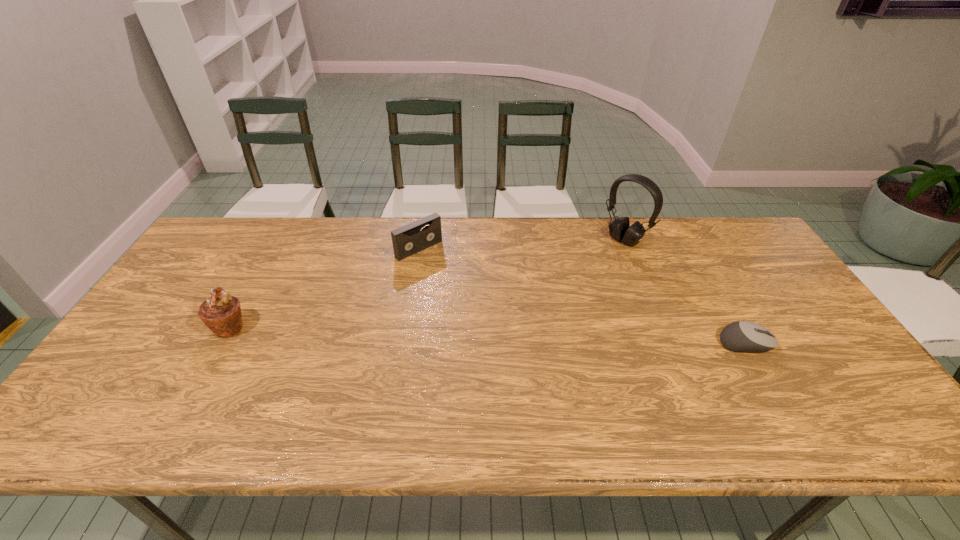
Find the location of `muffin`. muffin is located at coordinates (221, 313).

The height and width of the screenshot is (540, 960). I want to click on the second tallest object, so click(221, 313).

The width and height of the screenshot is (960, 540). I want to click on the rightmost object, so click(743, 336).

The image size is (960, 540). Identify the location of the shortest object. (743, 336).

Identify the location of videotape. The image size is (960, 540). (407, 240).

Image resolution: width=960 pixels, height=540 pixels. In order to click on the second shortest object in this screenshot , I will do `click(407, 240)`.

You are a GUI agent. You are given a task and a screenshot of the screen. Output one action in this format:
    pyautogui.click(x=<x>, y=<y>)
    Task: Click on the second object from right to left
    This screenshot has height=540, width=960.
    Given the screenshot: What is the action you would take?
    pyautogui.click(x=619, y=229)

What are the coordinates of `headset` in the screenshot? It's located at (619, 229).

The height and width of the screenshot is (540, 960). I want to click on vacant point located 0.260m on the back of the second tallest object, so click(x=270, y=255).

This screenshot has width=960, height=540. What are the coordinates of `free space located on the wheel side of the shortest object` in the screenshot? It's located at tap(800, 343).